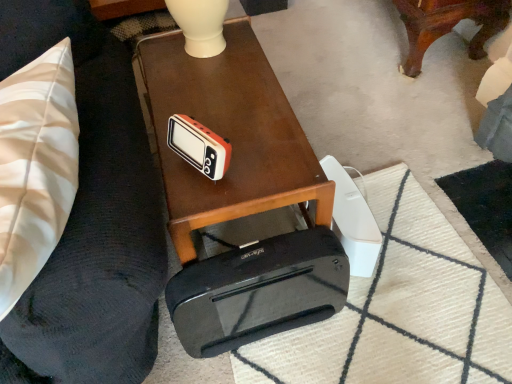
I want to click on vacant area on top of black rubber mat at lower center (from a real-world perspective), so click(x=380, y=312).